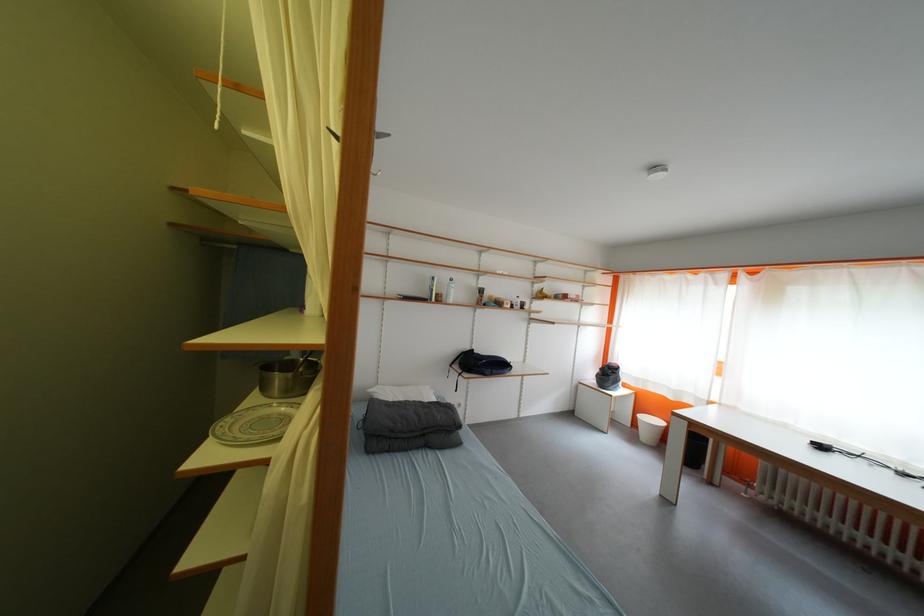
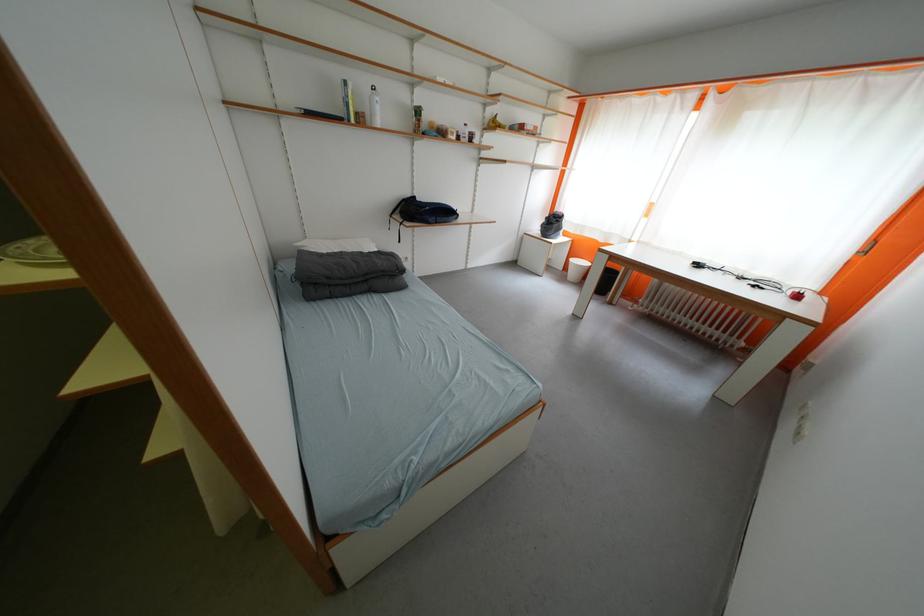
Question: How did the camera likely rotate?

Choices:
 (A) Left
 (B) Right
 (C) Up
 (D) Down

Answer: (D)